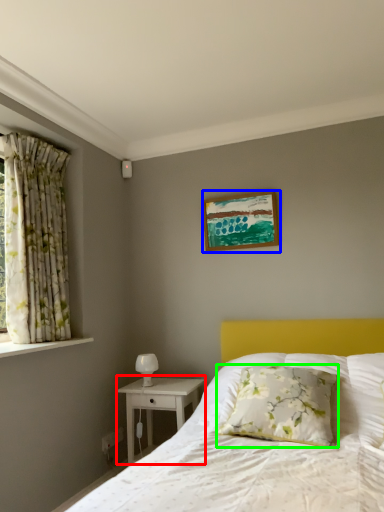
Question: Considering the real-world distances, which object is closest to nightstand (highlighted by a red box)? picture frame (highlighted by a blue box) or pillow (highlighted by a green box).

Choices:
 (A) picture frame
 (B) pillow

Answer: (B)